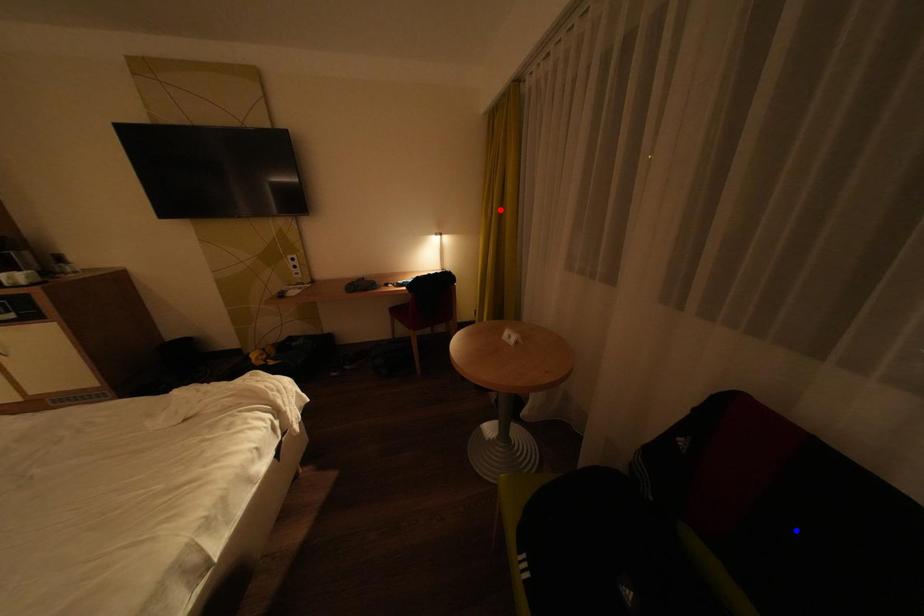
Question: Which of the two points in the image is closer to the camera?

Choices:
 (A) Blue point is closer.
 (B) Red point is closer.

Answer: (A)